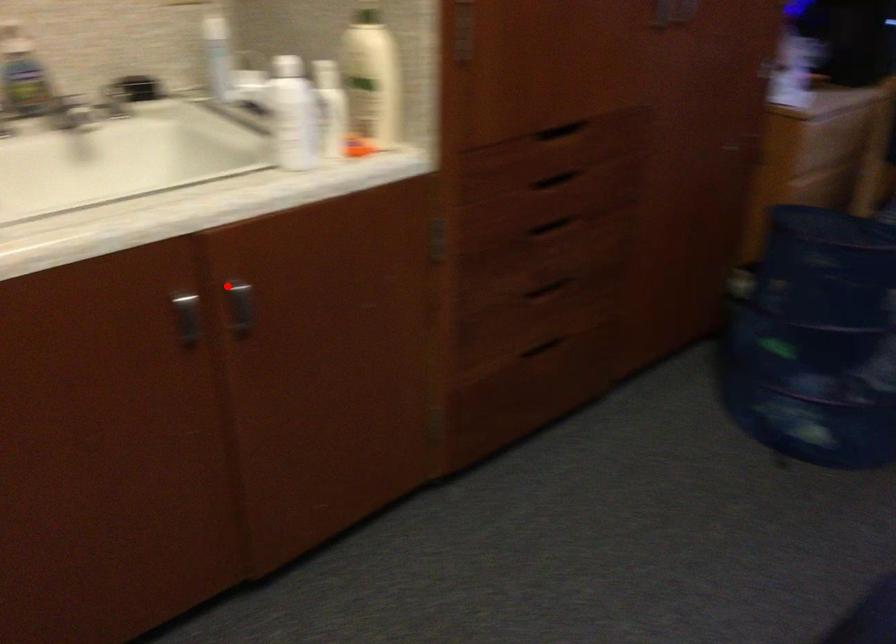
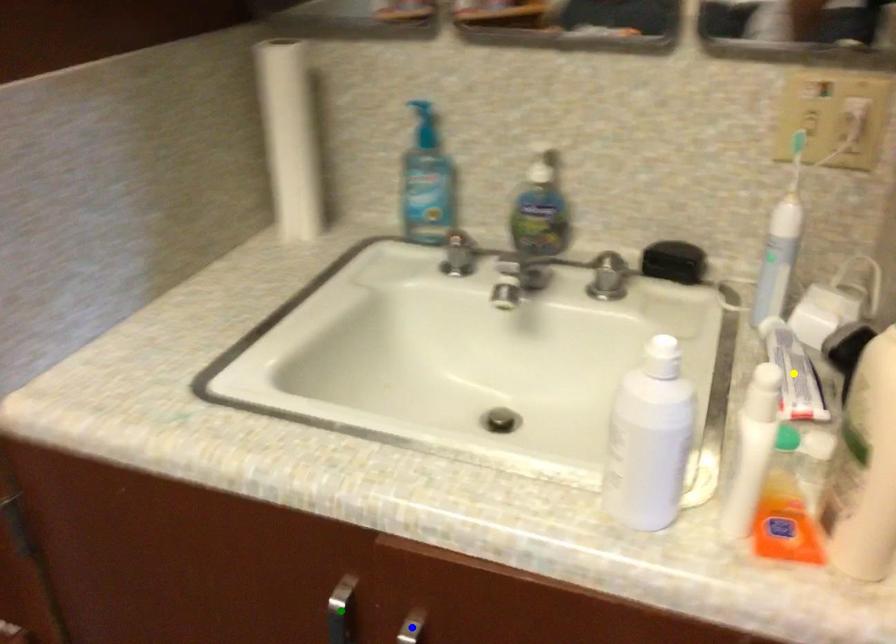
Question: I am providing you with two images of the same scene from different viewpoints. A red point is marked on the first image. You are given multiple points on the second image. In image 2, which mark is for the same physical point as the one in image 1?

Choices:
 (A) green point
 (B) yellow point
 (C) blue point

Answer: (C)